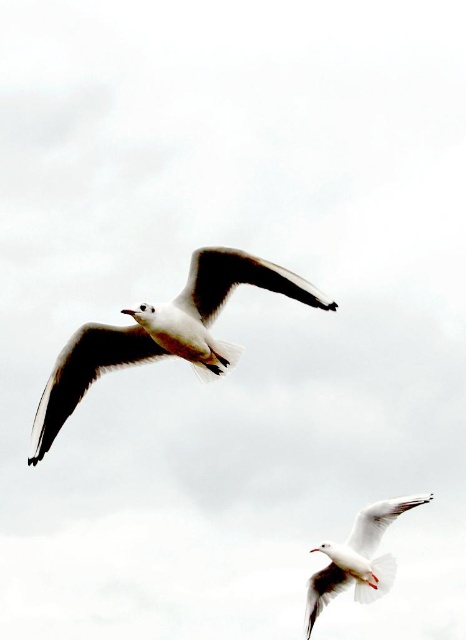
Question: Is white feathered bird at upper center above white feathered bird at lower right?

Choices:
 (A) no
 (B) yes

Answer: (B)

Question: Can you confirm if white feathered bird at upper center is positioned above white feathered bird at lower right?

Choices:
 (A) no
 (B) yes

Answer: (B)

Question: Among these objects, which one is nearest to the camera?

Choices:
 (A) white feathered bird at upper center
 (B) white feathered bird at lower right

Answer: (A)

Question: Is white feathered bird at upper center to the left of white feathered bird at lower right from the viewer's perspective?

Choices:
 (A) yes
 (B) no

Answer: (A)

Question: Which object is closer to the camera taking this photo?

Choices:
 (A) white feathered bird at lower right
 (B) white feathered bird at upper center

Answer: (B)

Question: Among these objects, which one is farthest from the camera?

Choices:
 (A) white feathered bird at upper center
 (B) white feathered bird at lower right

Answer: (B)